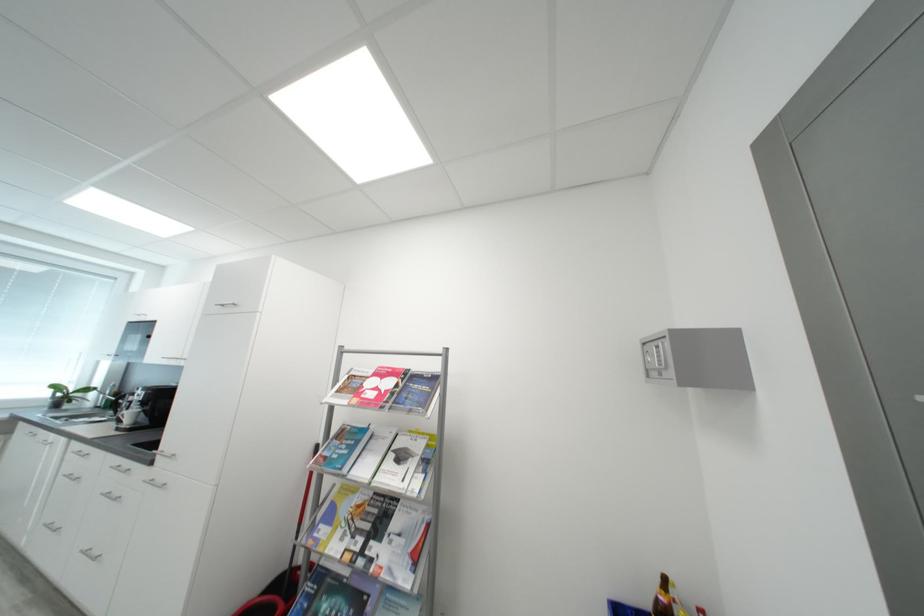
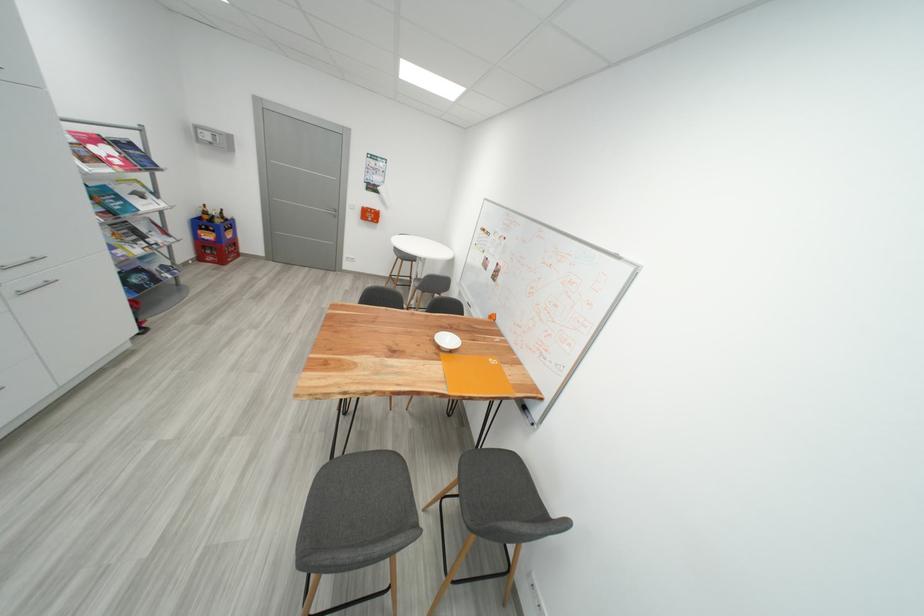
The point at [365,392] is marked in the first image. Where is the corresponding point in the second image?

(104, 161)